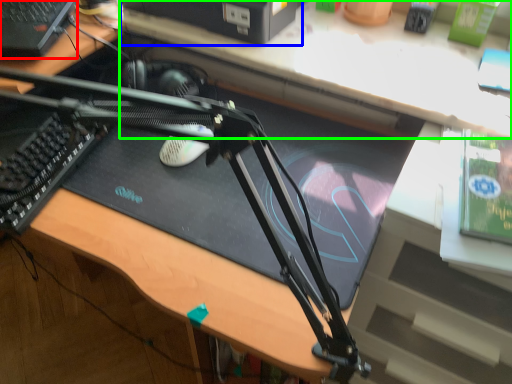
Question: Which is farther away from computer (highlighted by a red box)? computer (highlighted by a blue box) or computer desk (highlighted by a green box)?

Choices:
 (A) computer
 (B) computer desk

Answer: (B)